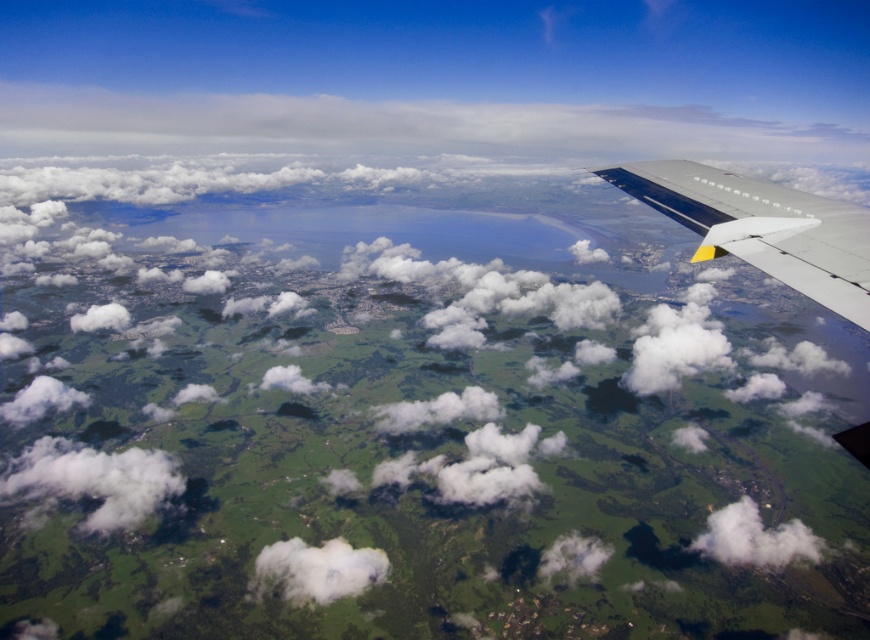
This screenshot has width=870, height=640. I want to click on white matte wing at upper right, so click(x=761, y=227).

Does point (744, 204) come farther from viewer compared to point (810, 548)?

No, it is in front of (810, 548).

Identify the location of white matte wing at upper right. The width and height of the screenshot is (870, 640). (761, 227).

Does white fluffy cloud at lower left have a lesser height compared to white fluffy cloud at center?

In fact, white fluffy cloud at lower left may be taller than white fluffy cloud at center.

Who is lower down, white fluffy cloud at lower left or white fluffy cloud at center?

Positioned lower is white fluffy cloud at center.

Locate an element on the screen. This screenshot has height=640, width=870. white fluffy cloud at lower left is located at coordinates (94, 480).

Does point (683, 205) lie in front of point (137, 490)?

Yes, point (683, 205) is in front of point (137, 490).

The image size is (870, 640). What do you see at coordinates (761, 227) in the screenshot?
I see `white matte wing at upper right` at bounding box center [761, 227].

Who is more distant from viewer, (687, 186) or (28, 497)?

The point (28, 497) is more distant.

You are a GUI agent. You are given a task and a screenshot of the screen. Output one action in this format:
    pyautogui.click(x=<x>, y=<y>)
    Task: Click on the white matte wing at upper right
    This screenshot has width=870, height=640.
    Given the screenshot: What is the action you would take?
    pyautogui.click(x=761, y=227)